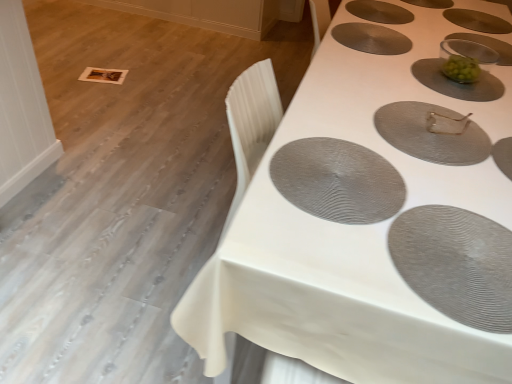
Where is `free space in front of matte gray placemat at upper center, positioned as the fifth oval in front-to-back order`? free space in front of matte gray placemat at upper center, positioned as the fifth oval in front-to-back order is located at coordinates (369, 66).